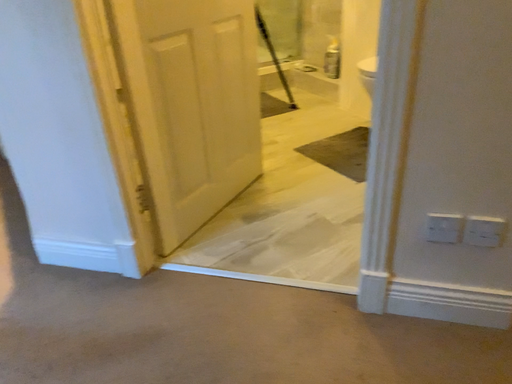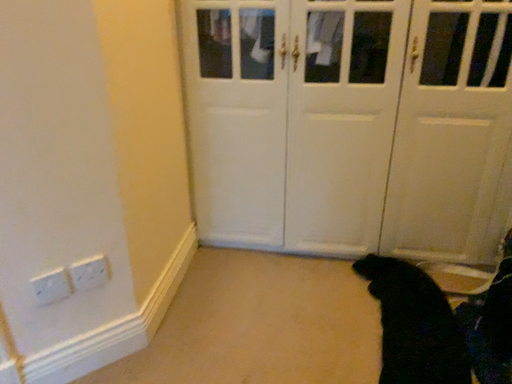
Question: How did the camera likely rotate when shooting the video?

Choices:
 (A) rotated upward
 (B) rotated downward

Answer: (A)